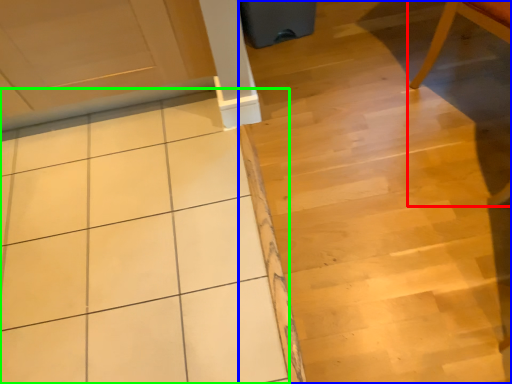
Question: Considering the real-world distances, which object is closest to chair (highlighted by a red box)? stair (highlighted by a blue box) or ceramic tile (highlighted by a green box).

Choices:
 (A) stair
 (B) ceramic tile

Answer: (A)